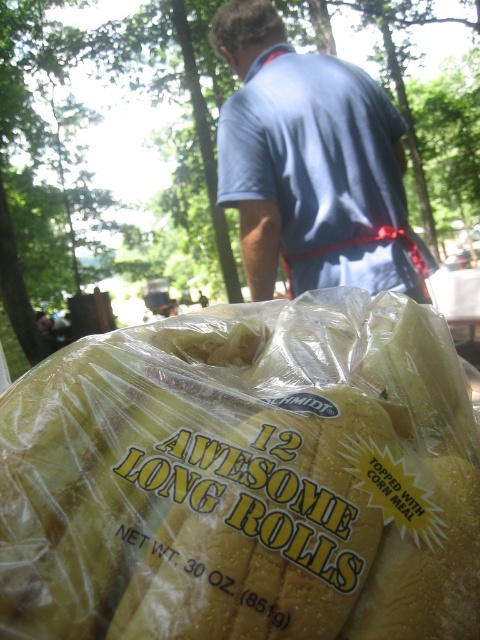
Which of these two, yellow plastic bag at bottom or blue fabric shirt at upper center, stands shorter?

yellow plastic bag at bottom

Is yellow plastic bag at bottom to the left of blue fabric shirt at upper center from the viewer's perspective?

Correct, you'll find yellow plastic bag at bottom to the left of blue fabric shirt at upper center.

Who is more distant from viewer, (164,413) or (278,209)?

Positioned behind is point (278,209).

Locate an element on the screen. This screenshot has width=480, height=640. yellow plastic bag at bottom is located at coordinates (244, 477).